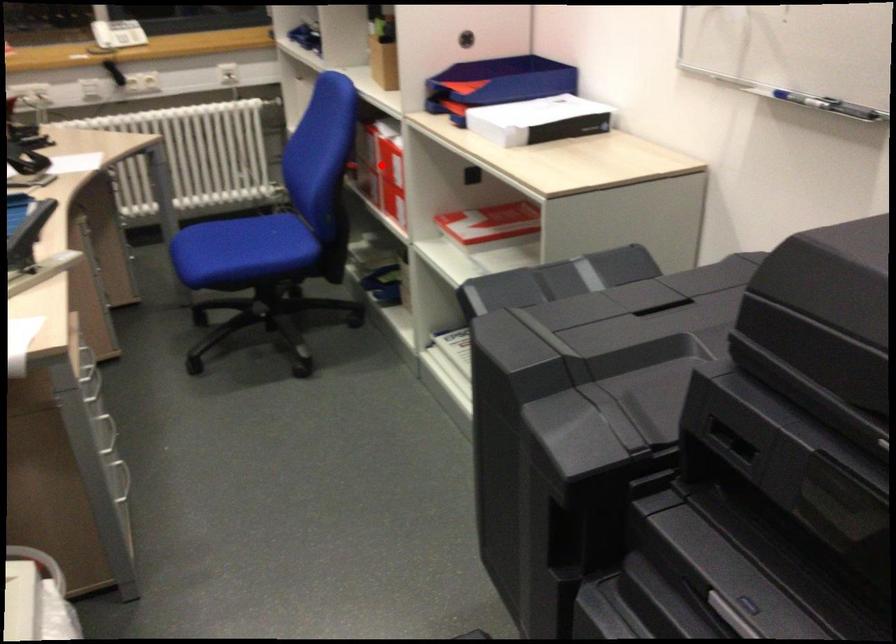
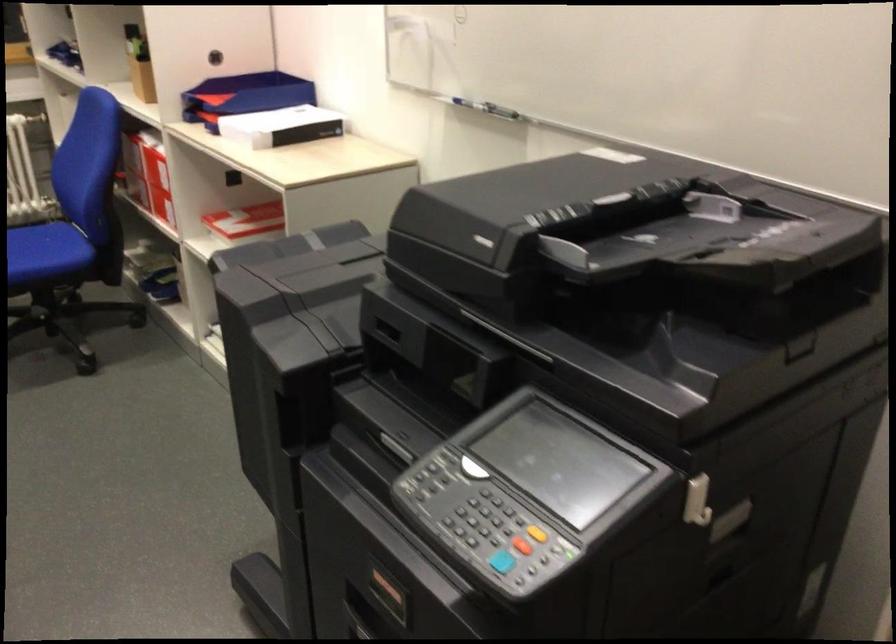
Where in the second image is the point corresponding to the highlighted location from the first image?

(148, 175)